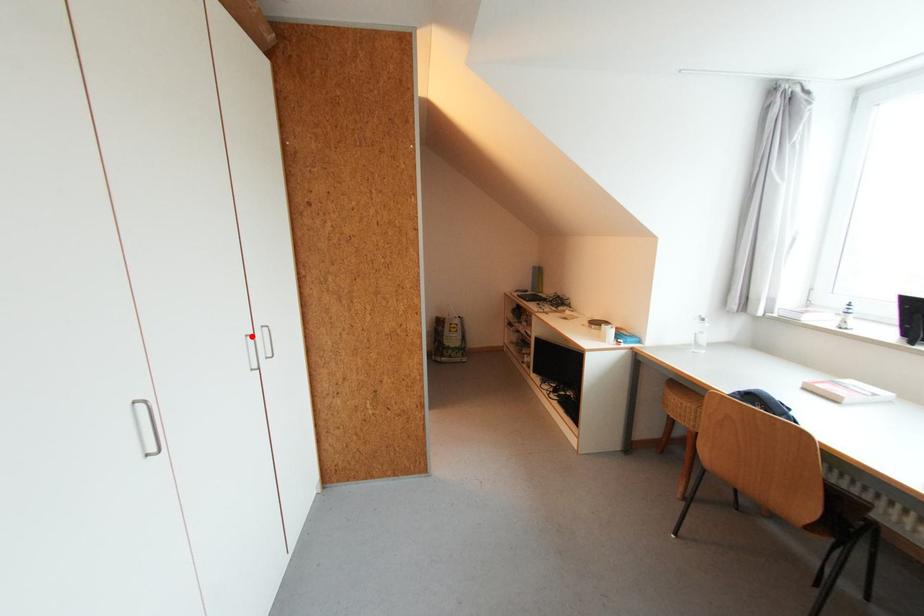
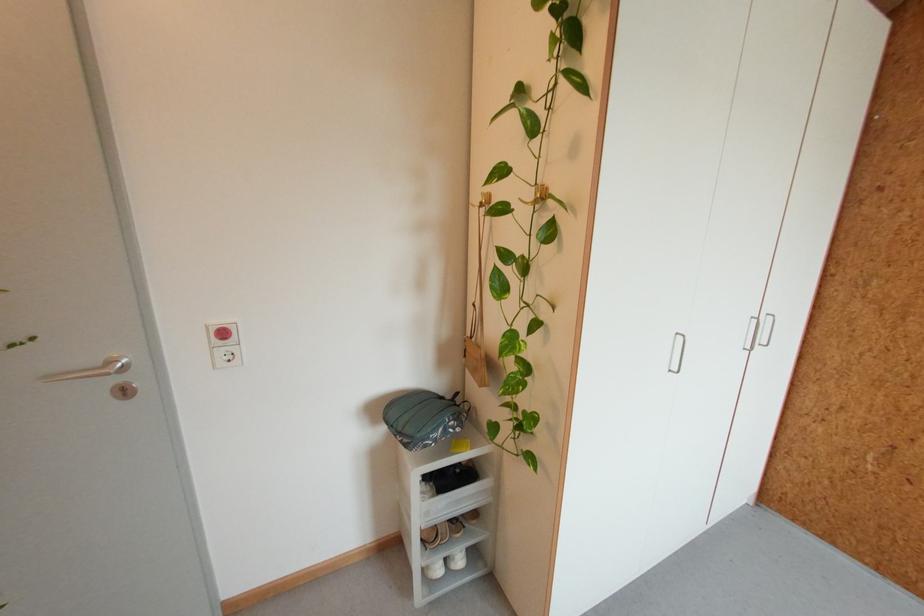
Locate, in the second image, the point that corresponds to the highlighted location in the first image.

(758, 318)